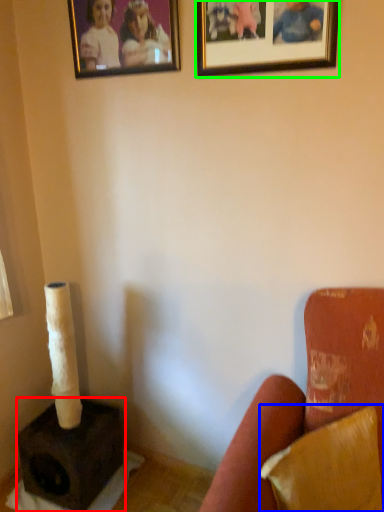
Question: Which object is the closest to the speaker (highlighted by a red box)? Choose among these: pillow (highlighted by a blue box) or picture frame (highlighted by a green box).

Choices:
 (A) pillow
 (B) picture frame

Answer: (A)